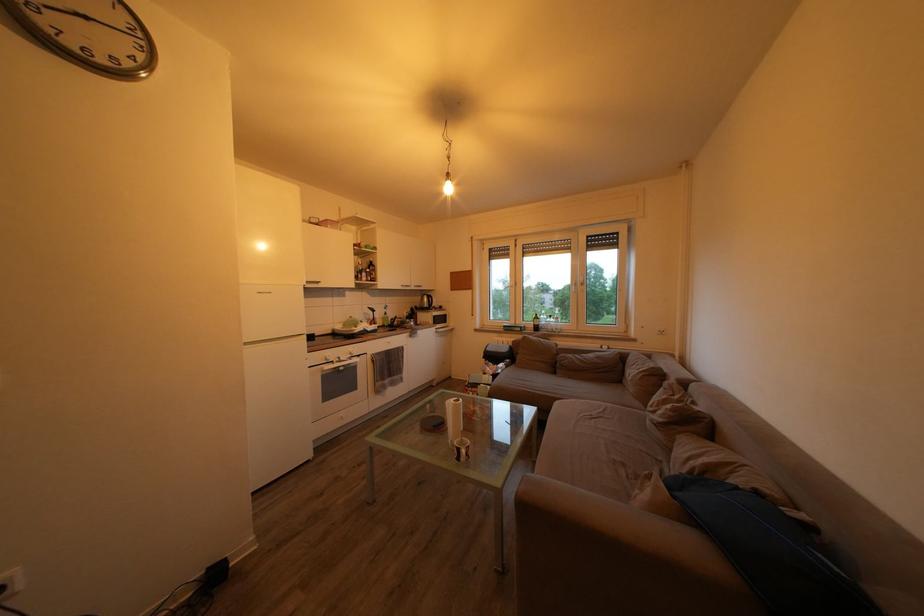
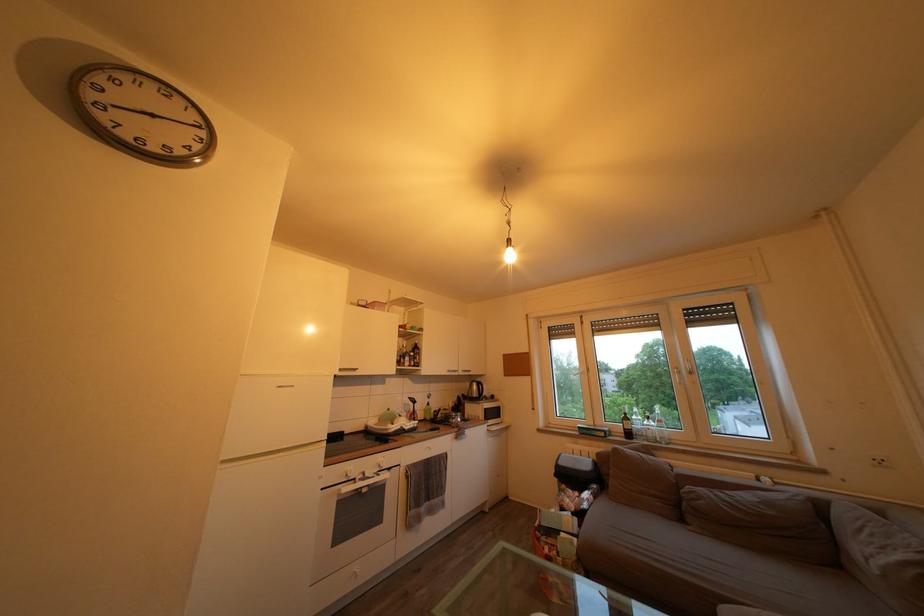
Locate, in the second image, the point that corresponds to point (394, 320) in the first image.

(436, 411)